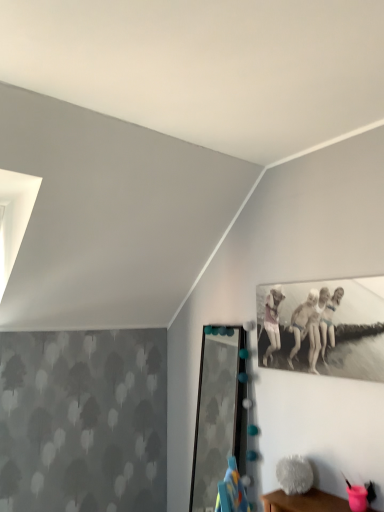
Measure the distance between clear glass mirror at center and camera.

clear glass mirror at center and camera are 2.58 meters apart from each other.

I want to click on clear glass mirror at center, so click(217, 413).

What do you see at coordinates (217, 413) in the screenshot?
I see `clear glass mirror at center` at bounding box center [217, 413].

The height and width of the screenshot is (512, 384). What are the coordinates of `clear glass mirror at center` in the screenshot? It's located at (217, 413).